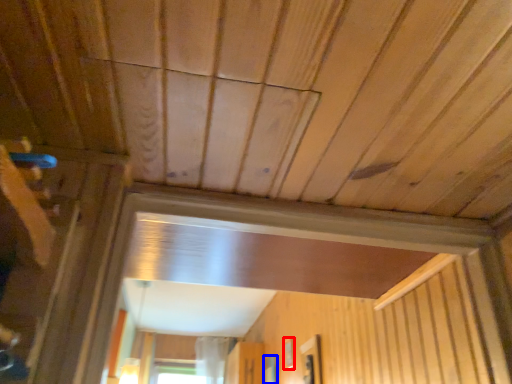
Question: Which of the following is the farthest to the observer, window (highlighted by a red box) or window (highlighted by a blue box)?

Choices:
 (A) window
 (B) window

Answer: (B)